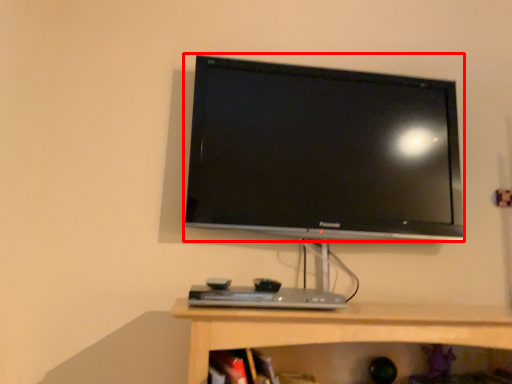
Question: From the image's perspective, where is television (annotated by the red box) located in relation to desktop in the image?

Choices:
 (A) below
 (B) above

Answer: (B)